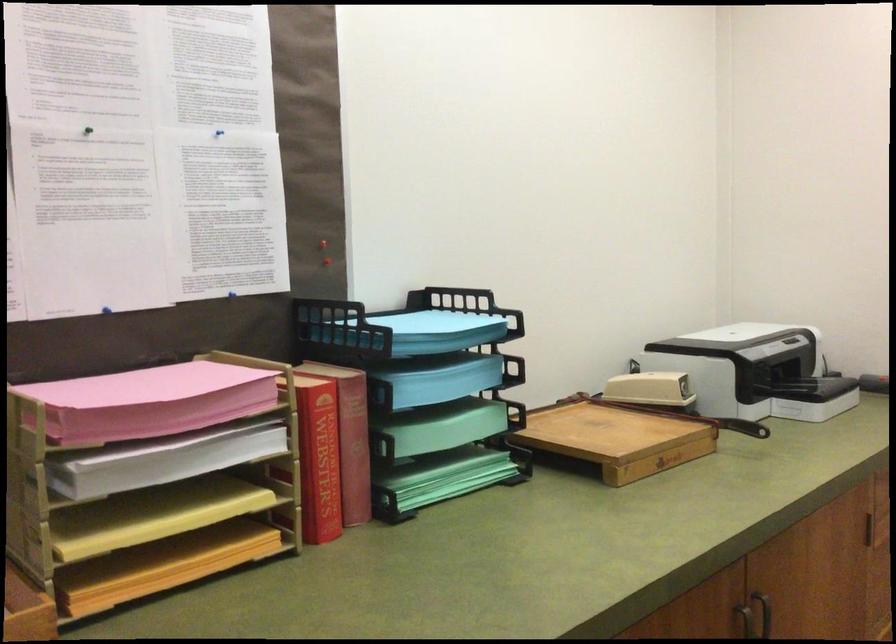
The location [409,325] corresponds to which object?

It refers to a light blue paper stack.